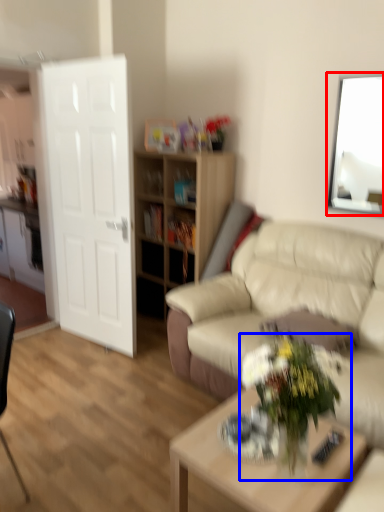
Question: Which object is further to the camera taking this photo, picture frame (highlighted by a red box) or houseplant (highlighted by a blue box)?

Choices:
 (A) picture frame
 (B) houseplant

Answer: (A)